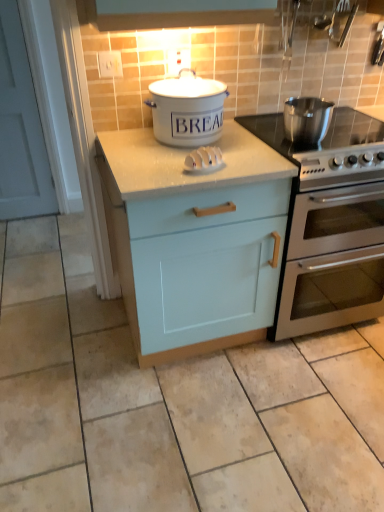
Image resolution: width=384 pixels, height=512 pixels. I want to click on vacant area on the back side of white plastic knife block at center, so click(201, 152).